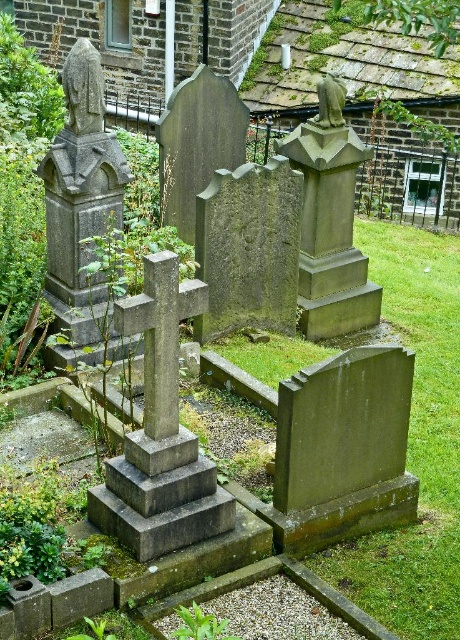
You are a maintenance worker in the cemetery. You need to move a 1.8 meter long gardening tool from the smooth gray stone statue at upper left to the green stone statue at center. Is there enough space to move it without tilting the tool?

The distance between the smooth gray stone statue at upper left and the green stone statue at center is 2.00 meters. Since the tool is 1.8 meters long, there is enough space to move it horizontally without tilting.

You are standing at the entrance of the cemetery and see two points marked in the image. Which point, point (92, 104) or point (333, 84), is closer to you?

Point (92, 104) is closer to the viewer than point (333, 84).